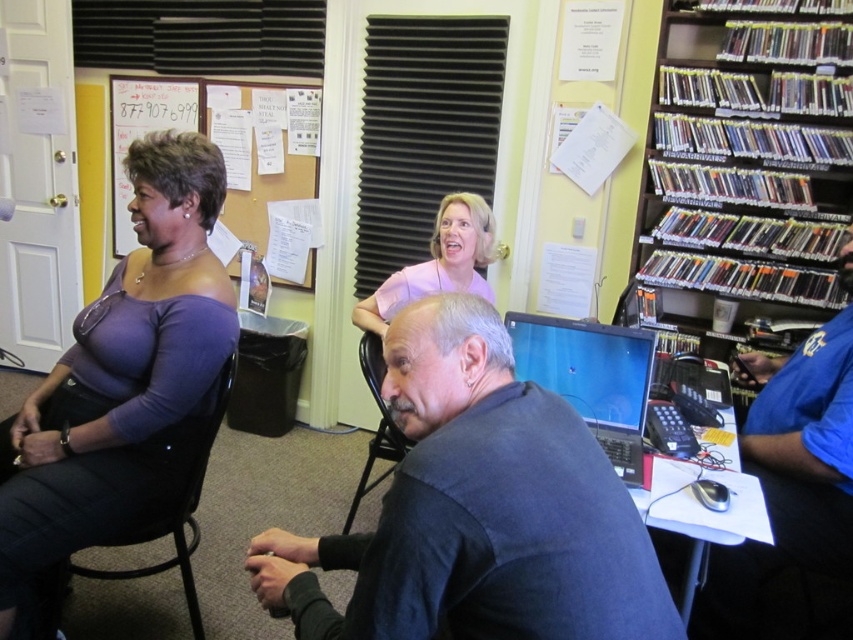
You are standing at the entrance of the room and want to reach the black plastic chair at lower center without walking behind the matte brown paper at upper left. Is this possible?

The matte brown paper at upper left is to the left of the black plastic chair at lower center, so you can walk around to the right side of the matte brown paper at upper left to reach the black plastic chair at lower center without going behind it.

You are standing at the entrance of the room and want to greet both the dark gray shirt at center and the blue shirt at right. Which one should you approach first to greet them in order from closest to farthest?

The dark gray shirt at center is to the left of blue shirt at right, so from your perspective at the entrance, the dark gray shirt at center is closer. You should greet them starting with the dark gray shirt at center first.

You are standing in the room and want to hang a new poster on the wall. The poster is taller than the pink matte blouse at upper center. Can the matte brown paper at upper left accommodate the poster in terms of height?

The matte brown paper at upper left has a greater height compared to the pink matte blouse at upper center. Since the poster is taller than the pink matte blouse at upper center, it may fit under the matte brown paper at upper left as it is taller.